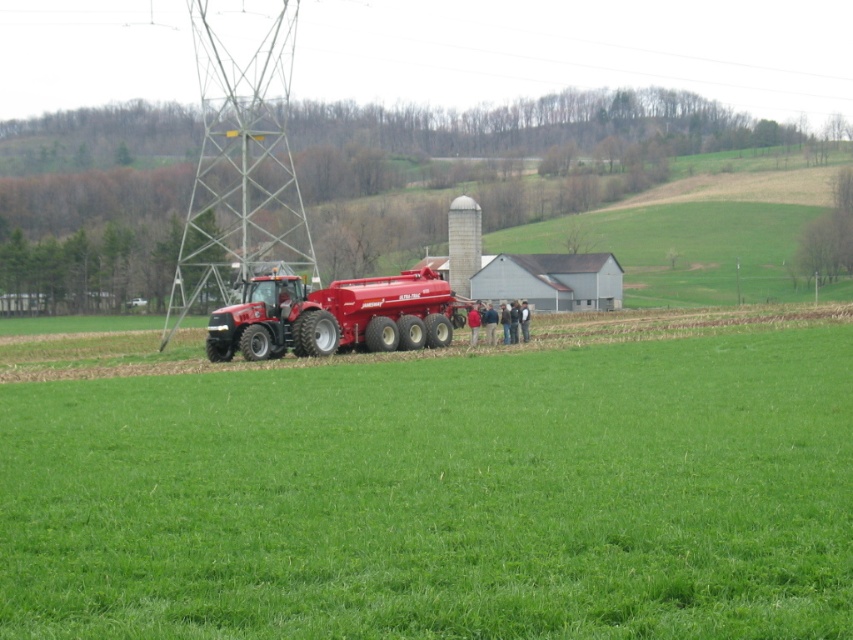
You are a farmer planning to drive your matte red tractor at center across the green grassy field at center. Based on the scene, will the tractor be visible from the barn and silo in the midground?

The green grassy field at center is in front of the matte red tractor at center, so the tractor will be visible from the barn and silo in the midground because it is positioned in front and closer to the viewer than the field.

You are a farmer who needs to move the matte red tractor at center to the green grassy field at center. Given that the tractor can move 10 feet per minute, how many minutes will it take to reach the field?

The matte red tractor at center and green grassy field at center are 75.67 feet apart. At a speed of 10 feet per minute, it would take approximately 7.57 minutes to reach the field.

From the picture: You are a farmer planning to drive your matte red tractor at center across the green grassy field at center. Based on the scene, will the tractor be able to move freely over the field?

The green grassy field at center is located below the matte red tractor at center, which suggests the tractor is parked on top of the field. Since the tractor is on the field, it should be able to move freely over the green grassy field at center as long as the terrain is suitable for its tires.